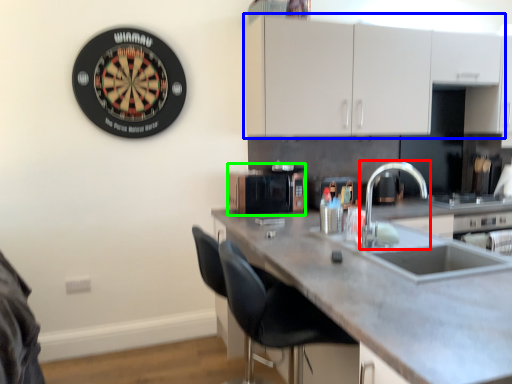
Question: Estimate the real-world distances between objects in this image. Which object is farther from tap (highlighted by a red box), cabinetry (highlighted by a blue box) or appliance (highlighted by a green box)?

Choices:
 (A) cabinetry
 (B) appliance

Answer: (A)